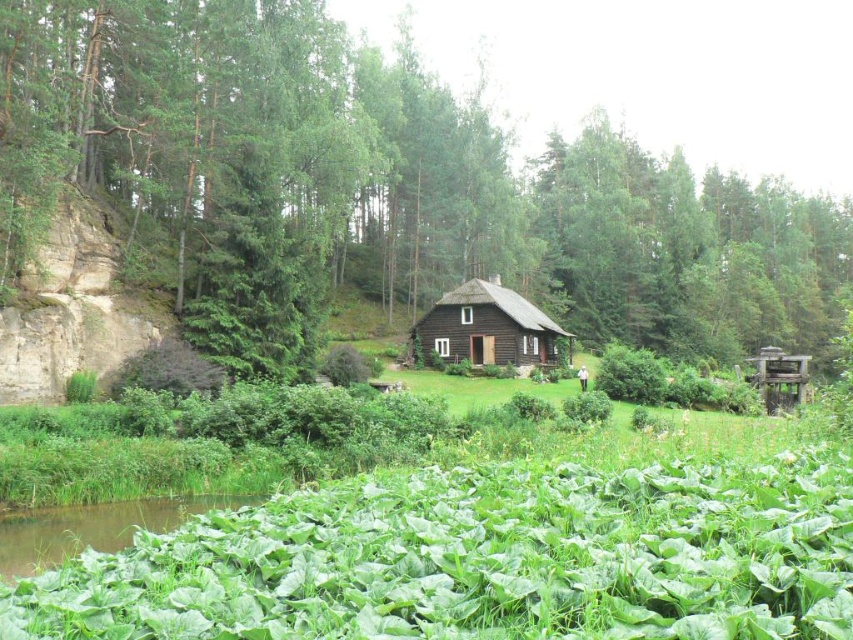
In the scene shown: You are planning to build a garden shed between the green leafy tree at center and the dark brown wooden cottage at center. Based on their sizes, which object will require more space around it to avoid overcrowding?

The green leafy tree at center will require more space around it because its width is larger than the dark brown wooden cottage at center.

What object is located at the point with coordinates (387, 182) in the image?

The point at coordinates (387, 182) indicates a green leafy tree at center.